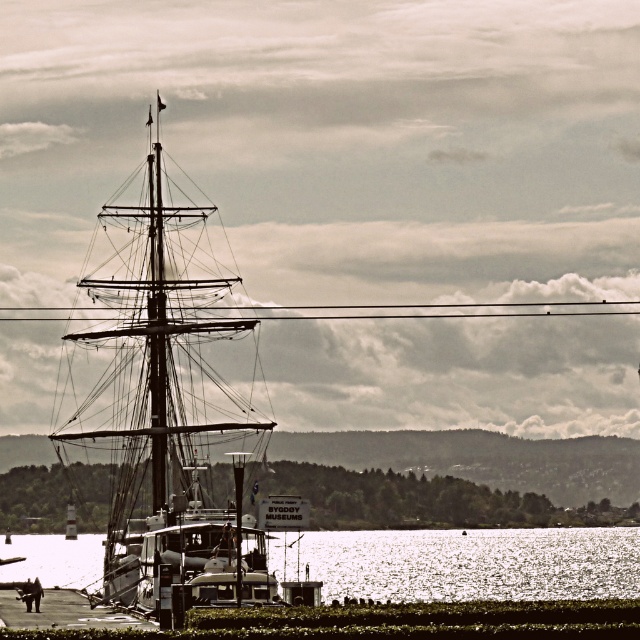
Question: Which of the following is the closest to the observer?

Choices:
 (A) (141, 520)
 (B) (628, 593)

Answer: (A)

Question: Does wooden ship at center have a greater width compared to glistening silver water at lower center?

Choices:
 (A) yes
 (B) no

Answer: (B)

Question: Can you confirm if wooden ship at center is thinner than glistening silver water at lower center?

Choices:
 (A) yes
 (B) no

Answer: (A)

Question: Is the position of wooden ship at center less distant than that of glistening silver water at lower center?

Choices:
 (A) yes
 (B) no

Answer: (A)

Question: Which point is closer to the camera?

Choices:
 (A) wooden ship at center
 (B) glistening silver water at lower center

Answer: (A)